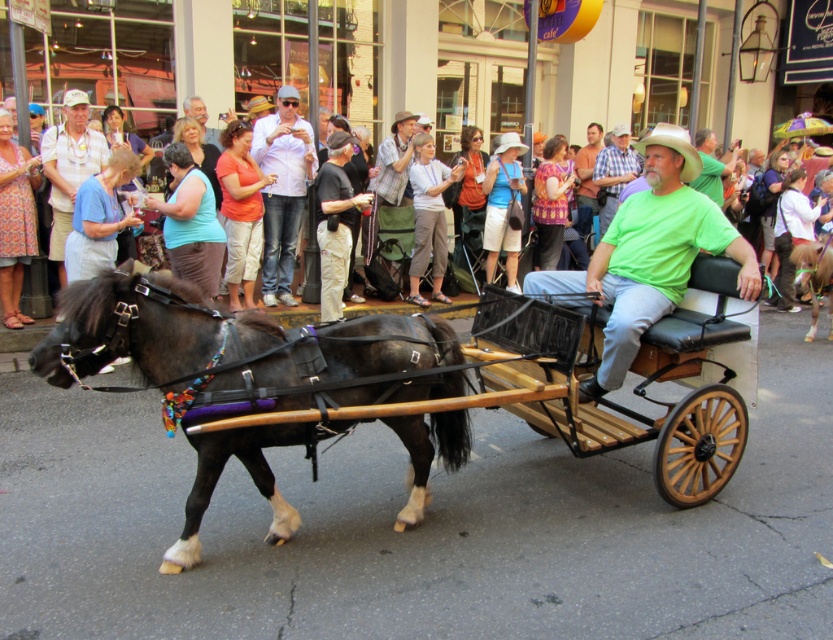
You are a photographer at the lively street scene. You want to capture a photo of both the green matte shirt at center and the printed fabric dress at center. Which one should you focus on first if you want to include both in your frame without moving the camera?

You should focus on the printed fabric dress at center first because the green matte shirt at center is to the right of it, so positioning the dress on the left side of the frame will allow both objects to be included without moving the camera.

You are a photographer trying to capture both the green matte shirt at center and the rustic brown cowboy hat at center in a single frame. Which object should you focus on first to ensure both are in the frame?

The green matte shirt at center is larger in size than rustic brown cowboy hat at center, so you should focus on the rustic brown cowboy hat at center first to ensure both are in the frame.

In the lively street scene with the horse and cart, where is the green matte shirt at center located relative to the gray hair at upper center?

The green matte shirt at center is to the right of gray hair at upper center.